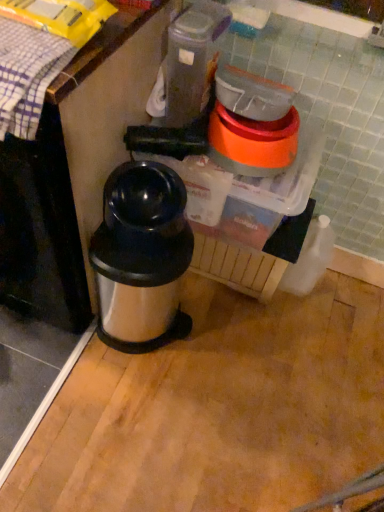
This screenshot has height=512, width=384. I want to click on unoccupied area in front of silver metallic thermos at center, so click(126, 399).